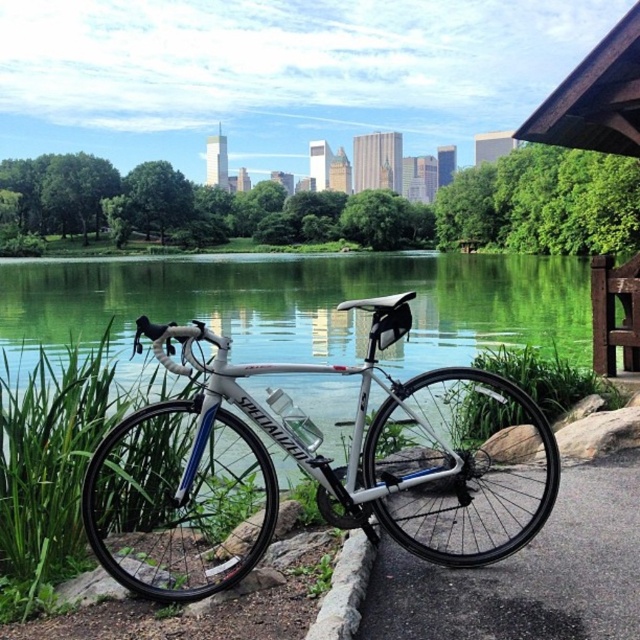
Is point (394, 449) positioned behind point (608, 268)?

No, (394, 449) is closer to viewer.

Does white metallic bicycle at center have a lesser width compared to brown wooden bench at right?

No, white metallic bicycle at center is not thinner than brown wooden bench at right.

Between point (140, 592) and point (628, 355), which one is positioned in front?

Positioned in front is point (140, 592).

Find the location of a particular element. The height and width of the screenshot is (640, 640). white metallic bicycle at center is located at coordinates (314, 467).

Between point (445, 554) and point (468, 616), which one is positioned behind?

The point (445, 554) is more distant.

Is white metallic bicycle at center wider than black asphalt pavement at lower right?

Correct, the width of white metallic bicycle at center exceeds that of black asphalt pavement at lower right.

Where is `white metallic bicycle at center`? The width and height of the screenshot is (640, 640). white metallic bicycle at center is located at coordinates (314, 467).

Does black asphalt pavement at lower right appear on the right side of brown wooden bench at right?

No, black asphalt pavement at lower right is not to the right of brown wooden bench at right.

Is black asphalt pavement at lower right further to camera compared to brown wooden bench at right?

→ No.

Between point (419, 595) and point (612, 346), which one is positioned in front?

Point (419, 595) is more forward.

Where is `black asphalt pavement at lower right`? black asphalt pavement at lower right is located at coordinates coord(529,573).